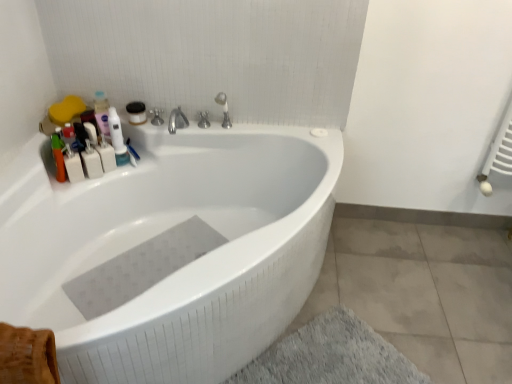
Question: Is polished chrome faucet at upper center, positioned as the 2th tap in right-to-left order, bigger or smaller than white glossy bathtub at upper center?

Choices:
 (A) small
 (B) big

Answer: (A)

Question: Is polished chrome faucet at upper center, positioned as the 2th tap in right-to-left order, wider or thinner than white glossy bathtub at upper center?

Choices:
 (A) wide
 (B) thin

Answer: (B)

Question: Estimate the real-world distances between objects in this image. Which object is closer to the white plastic bottles at upper left?

Choices:
 (A) polished chrome faucet at upper center, positioned as the 2th tap in right-to-left order
 (B) gray soft bath mat at lower right
 (C) satin nickel faucet at upper center, the first tap from the right
 (D) white plastic mouthwash at upper left, which ranks as the first mouthwash in left-to-right order
 (E) white glossy bathtub at upper center

Answer: (D)

Question: Which object is positioned farthest from the white plastic mouthwash at upper left, positioned as the 2th mouthwash in right-to-left order?

Choices:
 (A) white glossy bathtub at upper center
 (B) white plastic bottles at upper left
 (C) gray rubber mat at bottom
 (D) gray soft bath mat at lower right
 (E) satin nickel faucet at upper center, the first tap from the right

Answer: (D)